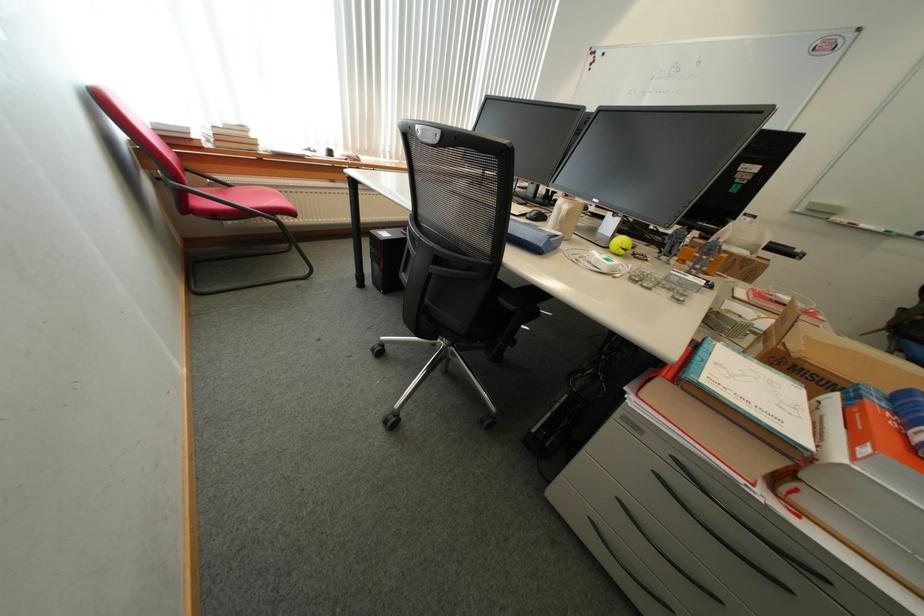
Which object does [565,216] point to?

It refers to a beige ceramic mug.